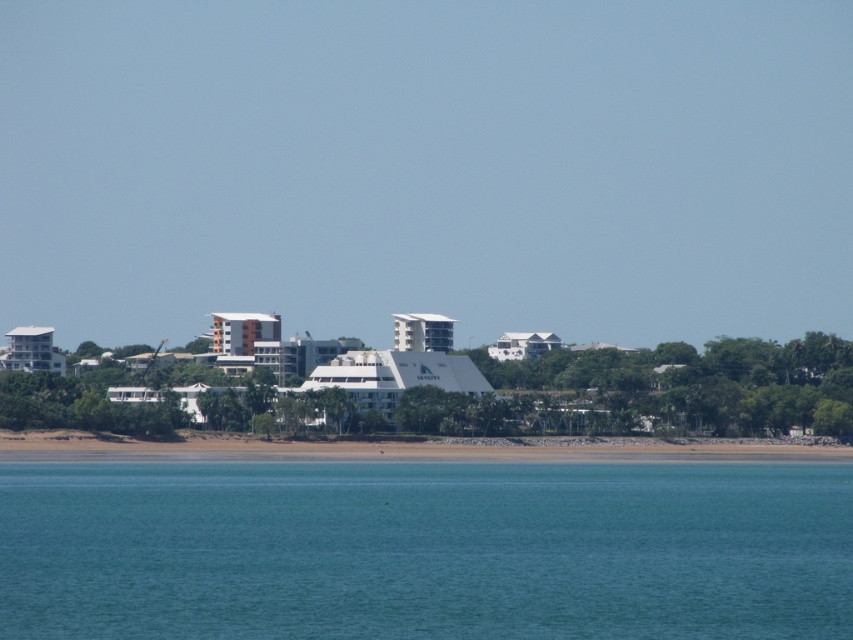
Question: Considering the relative positions of brown sand at lower center and white matte building at center in the image provided, where is brown sand at lower center located with respect to white matte building at center?

Choices:
 (A) above
 (B) below

Answer: (B)

Question: Which object is positioned closest to the white matte building at center?

Choices:
 (A) brown sand at lower center
 (B) clear blue water at lower center
 (C) white glossy hotel at center
 (D) white glossy building at left

Answer: (C)

Question: Does white matte building at center have a greater width compared to white glossy building at left?

Choices:
 (A) no
 (B) yes

Answer: (B)

Question: Where is clear blue water at lower center located in relation to brown sand at lower center in the image?

Choices:
 (A) below
 (B) above

Answer: (A)

Question: Which point is closer to the camera?

Choices:
 (A) white matte building at center
 (B) clear blue water at lower center
 (C) white glossy building at center
 (D) white glossy hotel at center

Answer: (B)

Question: Which object is the closest to the brown sand at lower center?

Choices:
 (A) white matte building at center
 (B) white glossy building at center
 (C) white glossy hotel at center

Answer: (A)